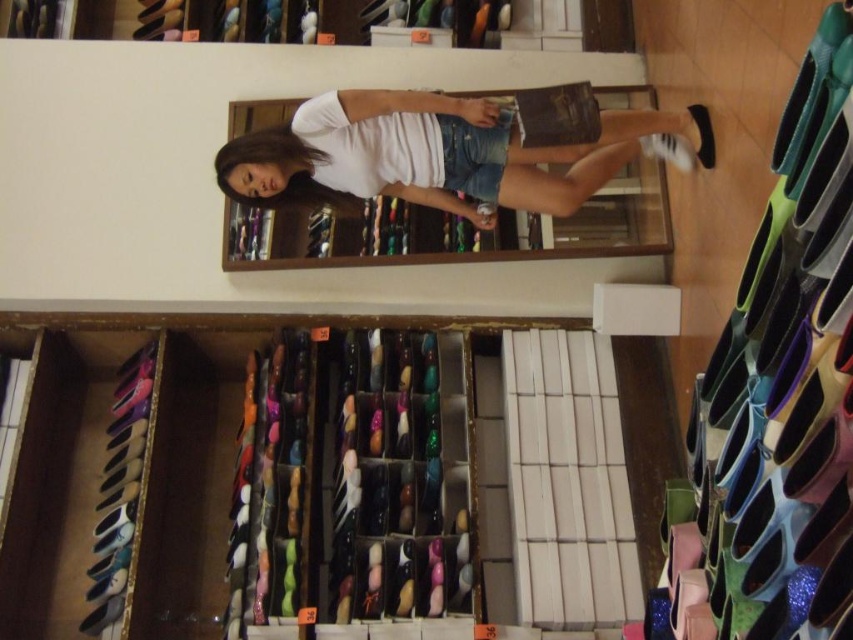
You are standing in the shoe store and want to find the wooden shoe rack at lower center. According to the store layout, where would you locate it?

The wooden shoe rack at lower center is located at point (393, 492) in the store layout.

You are standing at the entrance of the shoe store and want to reach the wooden shoe rack at lower center. Based on the coordinates provided in the description, in which direction should you move from your current position?

The wooden shoe rack at lower center is located at coordinates point (393, 492), so you should move towards the lower center direction from your current position at the entrance to reach it.